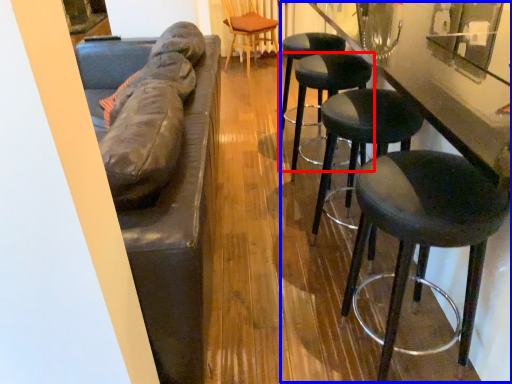
Question: Which point is further to the camera, stool (highlighted by a red box) or counter (highlighted by a blue box)?

Choices:
 (A) stool
 (B) counter

Answer: (A)